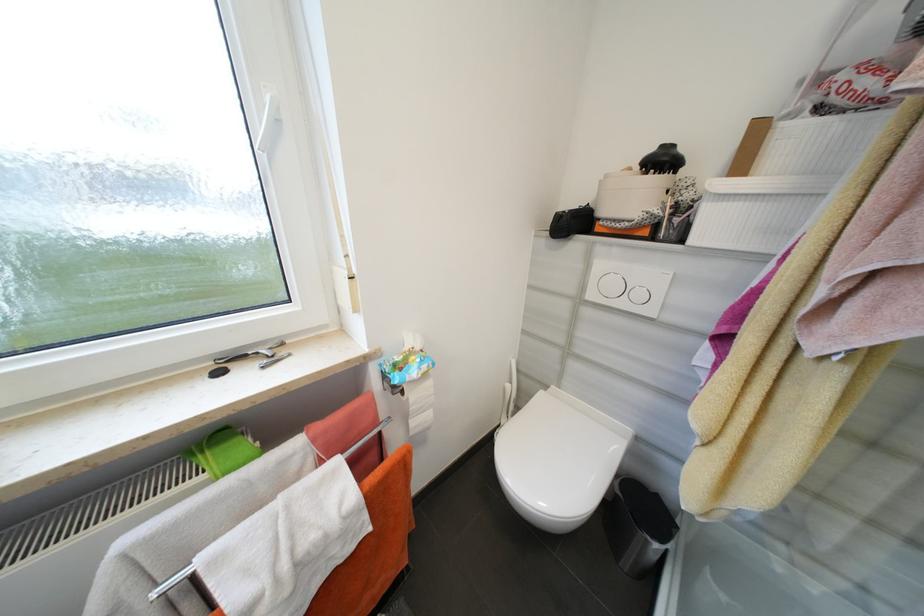
The width and height of the screenshot is (924, 616). What are the coordinates of `white storage box` in the screenshot? It's located at (783, 182).